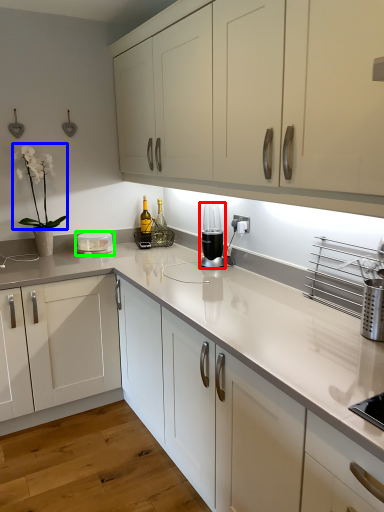
Question: Estimate the real-world distances between objects in this image. Which object is closer to home appliance (highlighted by a red box), plant (highlighted by a blue box) or appliance (highlighted by a green box)?

Choices:
 (A) plant
 (B) appliance

Answer: (B)